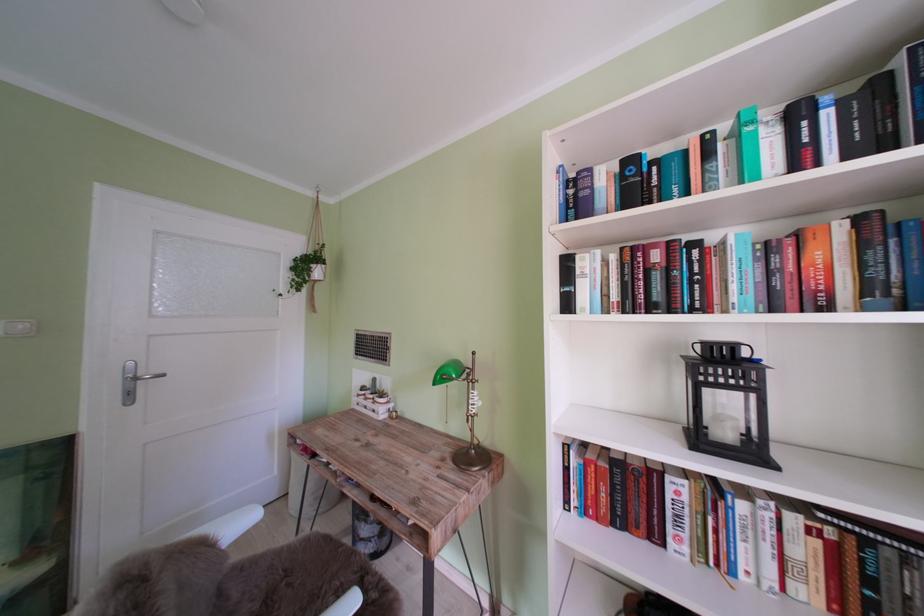
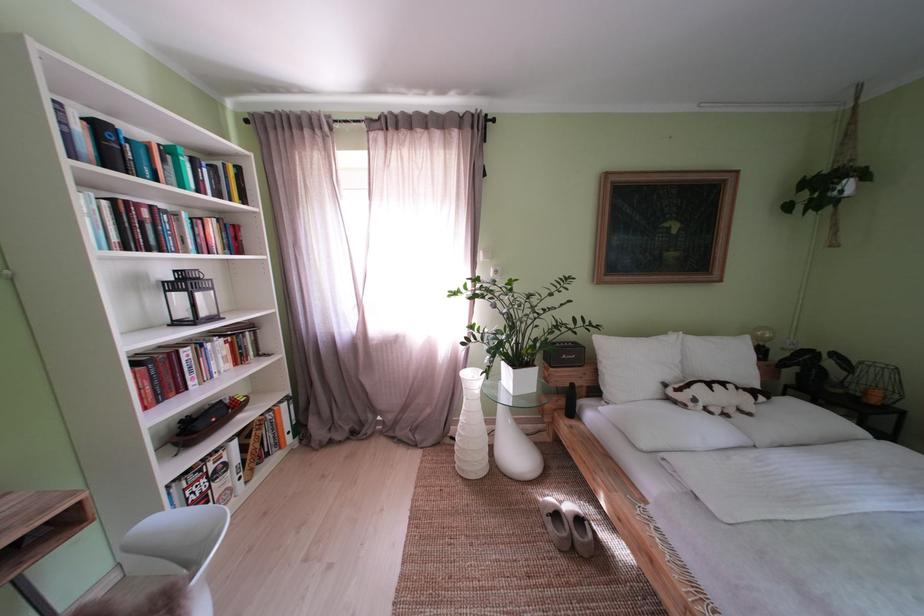
Question: I am providing you with two images of the same scene from different viewpoints. Please identify which objects are invisible in image2.

Choices:
 (A) white vase
 (B) orange binder
 (C) white light switch
 (D) none of these

Answer: (D)